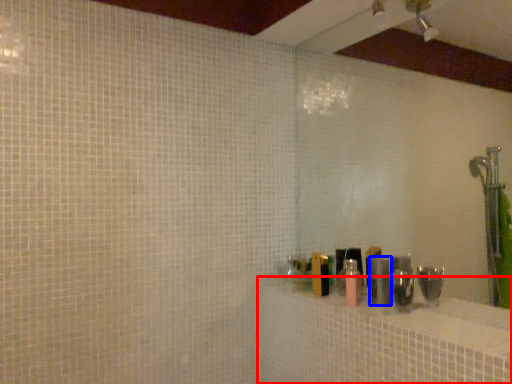
Question: Which object is further to the camera taking this photo, bath (highlighted by a red box) or toiletry (highlighted by a blue box)?

Choices:
 (A) bath
 (B) toiletry

Answer: (B)